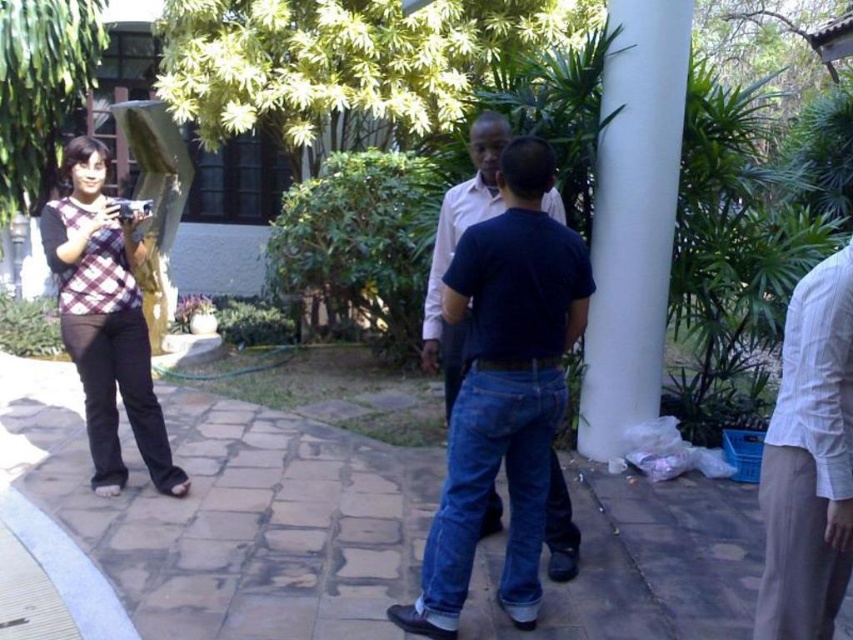
Question: Which object is the farthest from the plaid fabric top at left?

Choices:
 (A) white smooth pillar at center right
 (B) dark blue cotton shirt at center

Answer: (A)

Question: Can you confirm if white smooth pillar at center right is positioned to the left of dark blue cotton shirt at center?

Choices:
 (A) yes
 (B) no

Answer: (B)

Question: Which point is farther to the camera?

Choices:
 (A) white cotton shirt at right
 (B) plaid fabric top at left
 (C) dark blue cotton shirt at center
 (D) white smooth pillar at center right

Answer: (D)

Question: From the image, what is the correct spatial relationship of white smooth pillar at center right in relation to dark blue cotton shirt at center?

Choices:
 (A) below
 (B) above

Answer: (B)

Question: Which point is farther to the camera?

Choices:
 (A) (618, 278)
 (B) (762, 618)
 (C) (77, 253)

Answer: (A)

Question: Can you confirm if plaid fabric top at left is positioned below dark blue cotton shirt at center?

Choices:
 (A) no
 (B) yes

Answer: (B)